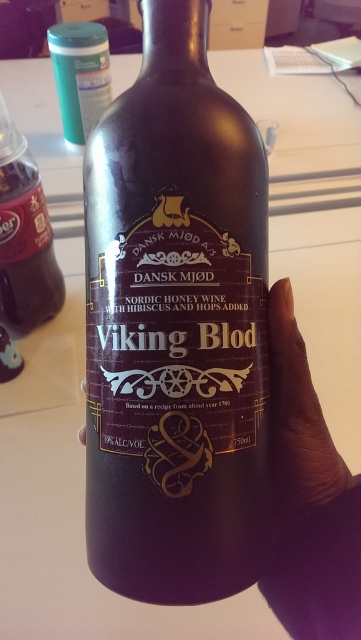
Does matte black bottle at center have a greater height compared to matte black bottle at left?

Yes.

Which of these two, matte black bottle at center or matte black bottle at left, stands taller?

Standing taller between the two is matte black bottle at center.

Image resolution: width=361 pixels, height=640 pixels. Identify the location of matte black bottle at center. (176, 326).

Can you confirm if matte black bottle at center is thinner than purple matte bottle at center?

No.

Is point (171, 298) more distant than point (294, 342)?

No, it is in front of (294, 342).

Who is more forward, (164, 243) or (297, 353)?

Positioned in front is point (164, 243).

The image size is (361, 640). I want to click on matte black bottle at center, so click(x=176, y=326).

Is purple matte bottle at center shorter than matte green plastic container at upper left?

Correct, purple matte bottle at center is not as tall as matte green plastic container at upper left.

Is purple matte bottle at center smaller than matte green plastic container at upper left?

Yes, purple matte bottle at center is smaller than matte green plastic container at upper left.

Between point (281, 396) and point (74, 60), which one is positioned in front?

Point (281, 396)

The image size is (361, 640). Find the location of `purple matte bottle at center`. purple matte bottle at center is located at coordinates (299, 412).